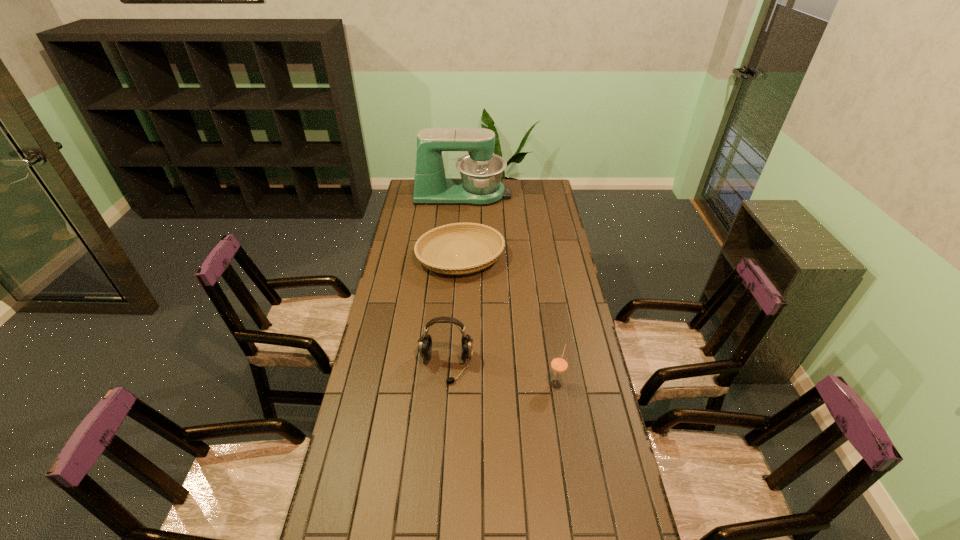
Where is `the tallest object`? the tallest object is located at coordinates (481, 171).

Locate an element on the screen. The height and width of the screenshot is (540, 960). the farthest object is located at coordinates (481, 171).

Identify the location of headset. (425, 341).

This screenshot has height=540, width=960. What are the coordinates of `straw` in the screenshot? It's located at (559, 364).

The image size is (960, 540). Find the location of `the rightmost object`. the rightmost object is located at coordinates (559, 364).

I want to click on basket, so click(x=440, y=241).

You are a GUI agent. You are given a task and a screenshot of the screen. Output one action in this format:
    pyautogui.click(x=<x>, y=<y>)
    Task: Click on the third nearest object
    The height and width of the screenshot is (540, 960).
    Given the screenshot: What is the action you would take?
    coord(440,241)

The width and height of the screenshot is (960, 540). Find the location of `vacant space located on the front-facing side of the tallest object`. vacant space located on the front-facing side of the tallest object is located at coordinates (530, 194).

At what (x,y) coordinates should I click in order to perform the action: click on vacant space located with the microphone on the side of the headset. Please return your answer as a coordinate pair (x, y). Image resolution: width=960 pixels, height=540 pixels. Looking at the image, I should click on (438, 482).

The width and height of the screenshot is (960, 540). I want to click on free space located 0.190m on the front of the second shortest object, so click(x=565, y=445).